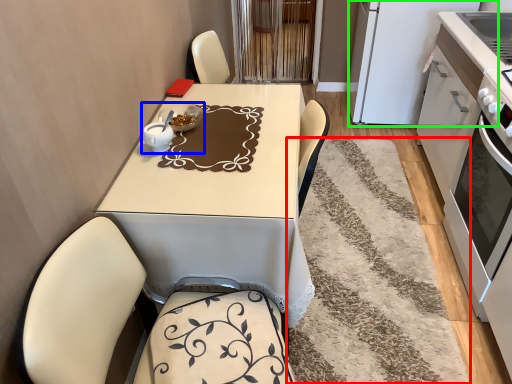
Question: Considering the real-world distances, which object is farthest from mat (highlighted by a red box)? tableware (highlighted by a blue box) or appliance (highlighted by a green box)?

Choices:
 (A) tableware
 (B) appliance

Answer: (A)